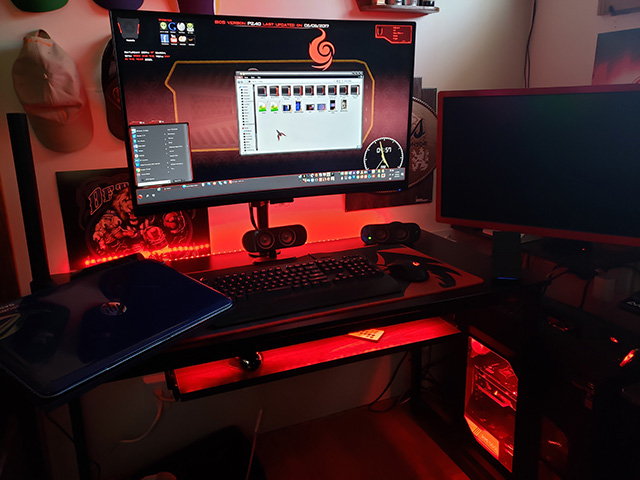
Identify the location of speakers. Image resolution: width=640 pixels, height=480 pixels. (276, 241).